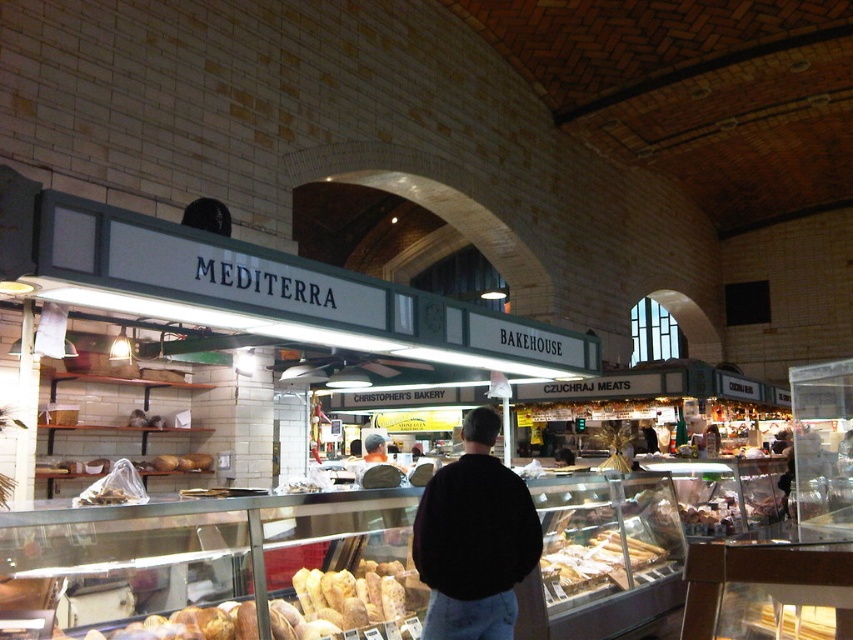
You are a customer in the MEDITERRA BAKEHOUSE. You want to pick up the golden brown crusty bread at center but there is a person wearing a black sweater at center blocking your path. Can you reach the bread without moving the person?

The black sweater at center is 1.94 meters away from golden brown crusty bread at center. Since the distance between them is over 1.5 meters, you can reach the bread without moving the person.

You are a customer in the MEDITERRA BAKEHOUSE. You see a black sweater at center and a golden brown crusty bread at center. Which object is larger?

The golden brown crusty bread at center is larger than the black sweater at center.

You are a customer in the MEDITERRA BAKEHOUSE. You see a black sweater at center and a golden crusty bread at center. Which item is closer to you?

The black sweater at center is closer to you because it is positioned over the golden crusty bread at center, indicating it is in front.